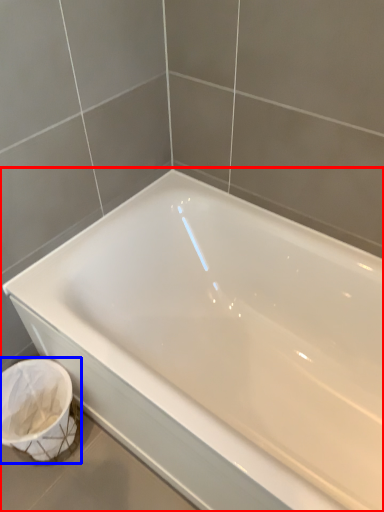
Question: Which point is further to the camera, bathtub (highlighted by a red box) or laundry basket (highlighted by a blue box)?

Choices:
 (A) bathtub
 (B) laundry basket

Answer: (B)